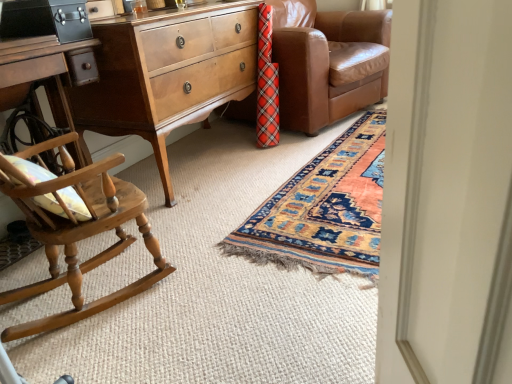
Question: From a real-world perspective, does black leather briefcase at upper left stand above light brown wood nightstand at left?

Choices:
 (A) no
 (B) yes

Answer: (B)

Question: From a real-world perspective, is black leather briefcase at upper left physically below light brown wood nightstand at left?

Choices:
 (A) yes
 (B) no

Answer: (B)

Question: Is black leather briefcase at upper left oriented away from light brown wood nightstand at left?

Choices:
 (A) no
 (B) yes

Answer: (A)

Question: Does black leather briefcase at upper left have a smaller size compared to light brown wood nightstand at left?

Choices:
 (A) no
 (B) yes

Answer: (B)

Question: From the image's perspective, does black leather briefcase at upper left appear lower than light brown wood nightstand at left?

Choices:
 (A) no
 (B) yes

Answer: (A)

Question: Does black leather briefcase at upper left have a greater height compared to light brown wood nightstand at left?

Choices:
 (A) no
 (B) yes

Answer: (A)

Question: Considering the relative sizes of light brown wood nightstand at left and wooden rocking chair at left in the image provided, is light brown wood nightstand at left wider than wooden rocking chair at left?

Choices:
 (A) no
 (B) yes

Answer: (B)

Question: From a real-world perspective, is light brown wood nightstand at left positioned over wooden rocking chair at left based on gravity?

Choices:
 (A) no
 (B) yes

Answer: (B)

Question: Does light brown wood nightstand at left have a smaller size compared to wooden rocking chair at left?

Choices:
 (A) no
 (B) yes

Answer: (A)

Question: Is light brown wood nightstand at left in contact with wooden rocking chair at left?

Choices:
 (A) yes
 (B) no

Answer: (B)

Question: Is the position of light brown wood nightstand at left less distant than that of wooden rocking chair at left?

Choices:
 (A) no
 (B) yes

Answer: (A)

Question: From the image's perspective, is light brown wood nightstand at left below wooden rocking chair at left?

Choices:
 (A) no
 (B) yes

Answer: (A)

Question: From the image's perspective, is brown leather couch at center on top of black leather briefcase at upper left?

Choices:
 (A) no
 (B) yes

Answer: (B)